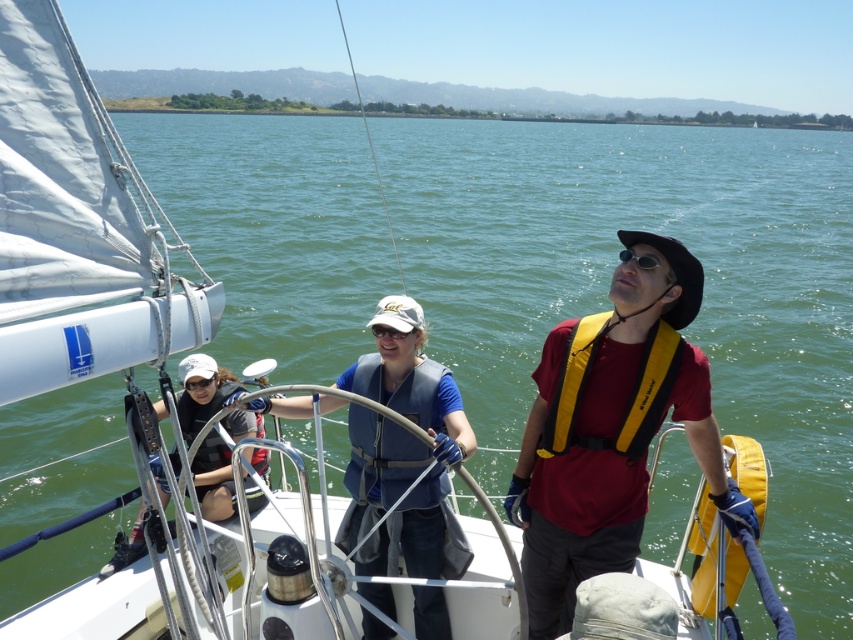
In the scene shown: Which is below, maroon fabric shirt at center or yellow/yellowish fabric life jacket at right?

maroon fabric shirt at center is below.

Can you confirm if maroon fabric shirt at center is taller than yellow/yellowish fabric life jacket at right?

Yes, maroon fabric shirt at center is taller than yellow/yellowish fabric life jacket at right.

Where is `maroon fabric shirt at center`? The width and height of the screenshot is (853, 640). maroon fabric shirt at center is located at coordinates (610, 429).

Does yellow/yellowish fabric life jacket at right have a greater width compared to black rubber goggles at left?

Yes.

Between point (529, 433) and point (183, 385), which one is positioned behind?

Positioned behind is point (183, 385).

What are the coordinates of `yellow/yellowish fabric life jacket at right` in the screenshot? It's located at [544, 400].

Is point (357, 531) positioned behind point (554, 364)?

Yes, it is behind point (554, 364).

Is blue fabric life vest at center above yellow/yellowish fabric life jacket at right?

No, blue fabric life vest at center is not above yellow/yellowish fabric life jacket at right.

The width and height of the screenshot is (853, 640). I want to click on blue fabric life vest at center, so click(x=399, y=449).

Identify the location of blue fabric life vest at center. This screenshot has width=853, height=640. (399, 449).